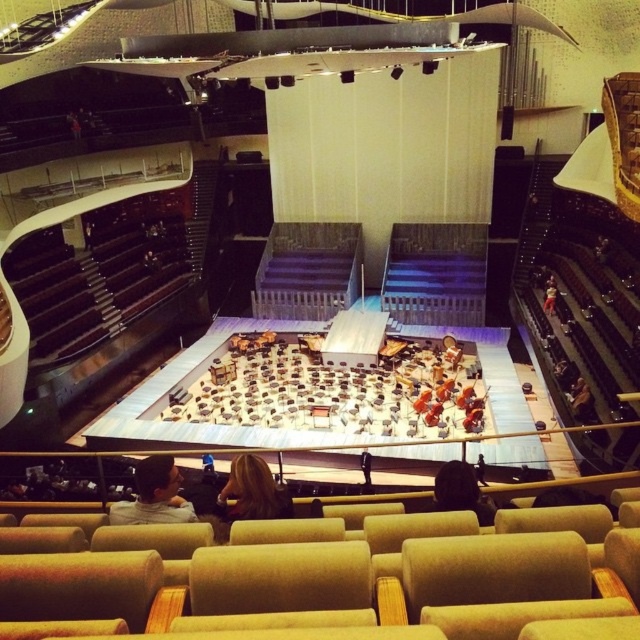
Question: Can you confirm if light brown leather jacket at lower center is positioned below black leather jacket at center?

Choices:
 (A) no
 (B) yes

Answer: (A)

Question: Which point is farther to the camera?

Choices:
 (A) brown hair at center
 (B) black leather jacket at center

Answer: (A)

Question: Based on their relative distances, which object is nearer to the brown hair at center?

Choices:
 (A) black leather jacket at center
 (B) light brown leather jacket at lower center

Answer: (B)

Question: Which object is positioned closest to the light brown leather jacket at lower center?

Choices:
 (A) brown hair at center
 (B) black leather jacket at center

Answer: (A)

Question: Is brown hair at center smaller than black leather jacket at center?

Choices:
 (A) no
 (B) yes

Answer: (A)

Question: Is brown hair at center below black leather jacket at center?

Choices:
 (A) no
 (B) yes

Answer: (A)